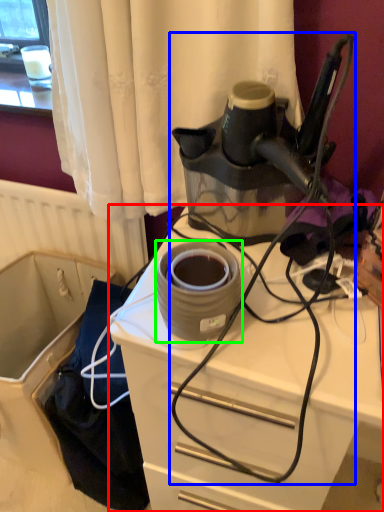
Question: Which object is positioned farthest from desk (highlighted by a red box)? Select from wire (highlighted by a blue box) and appliance (highlighted by a green box).

Choices:
 (A) wire
 (B) appliance

Answer: (B)